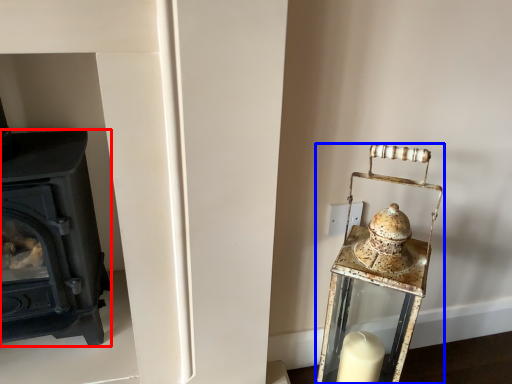
Question: Among these objects, which one is nearest to the camera, wood burning stove (highlighted by a red box) or table lamp (highlighted by a blue box)?

Choices:
 (A) wood burning stove
 (B) table lamp

Answer: (B)